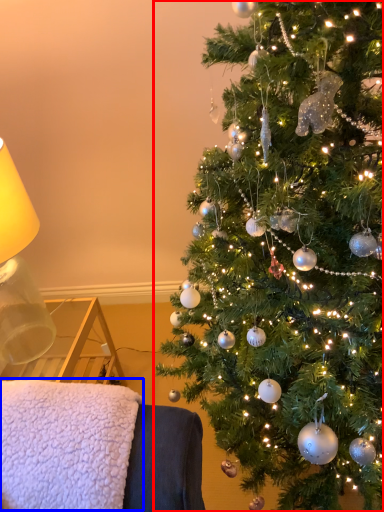
Question: Which object is further to the camera taking this photo, christmas tree (highlighted by a red box) or blanket (highlighted by a blue box)?

Choices:
 (A) christmas tree
 (B) blanket

Answer: (B)